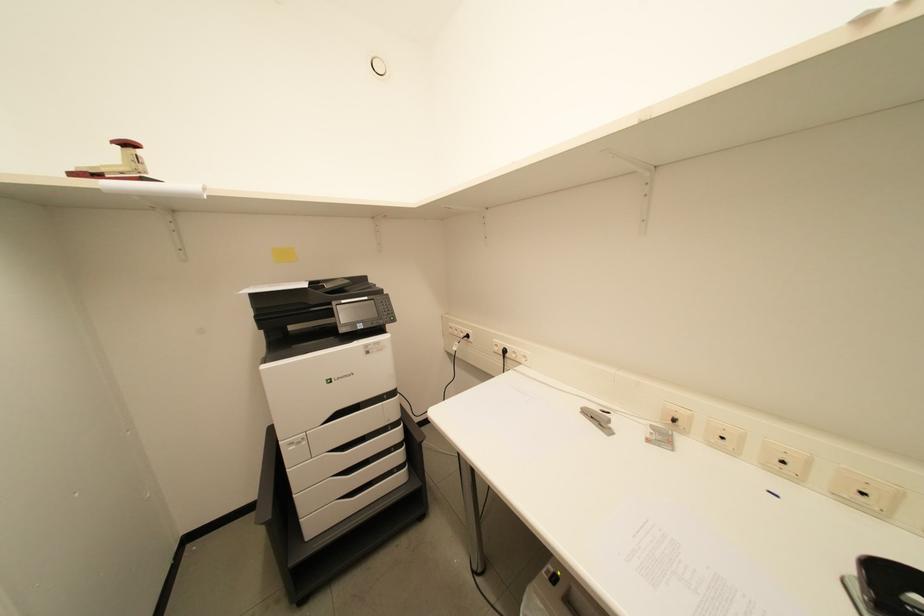
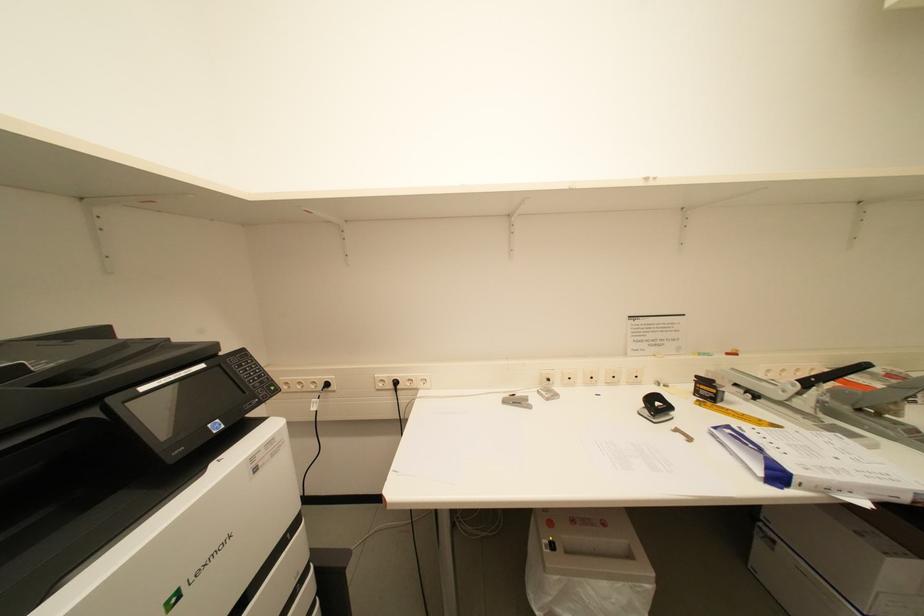
Question: The images are taken continuously from a first-person perspective. In which direction is your viewpoint rotating?

Choices:
 (A) Left
 (B) Right
 (C) Up
 (D) Down

Answer: (B)